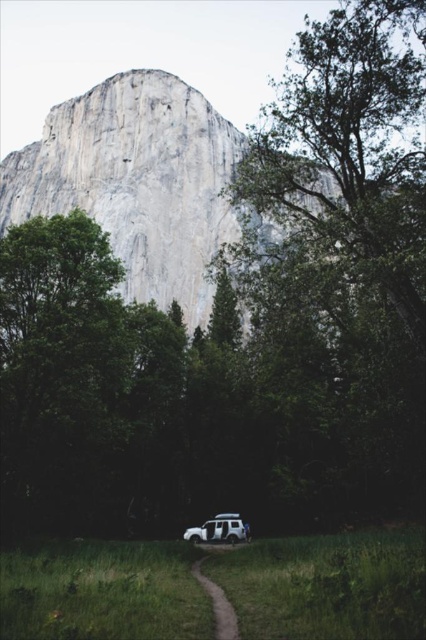
Is point (218, 627) positioned in front of point (216, 534)?

Yes, it is.

Is dirt path at center smaller than white matte jeep at lower center?

Actually, dirt path at center might be larger than white matte jeep at lower center.

Who is more distant from viewer, (218, 618) or (213, 532)?

Point (213, 532)

Find the location of `dirt path at center`. dirt path at center is located at coordinates (218, 604).